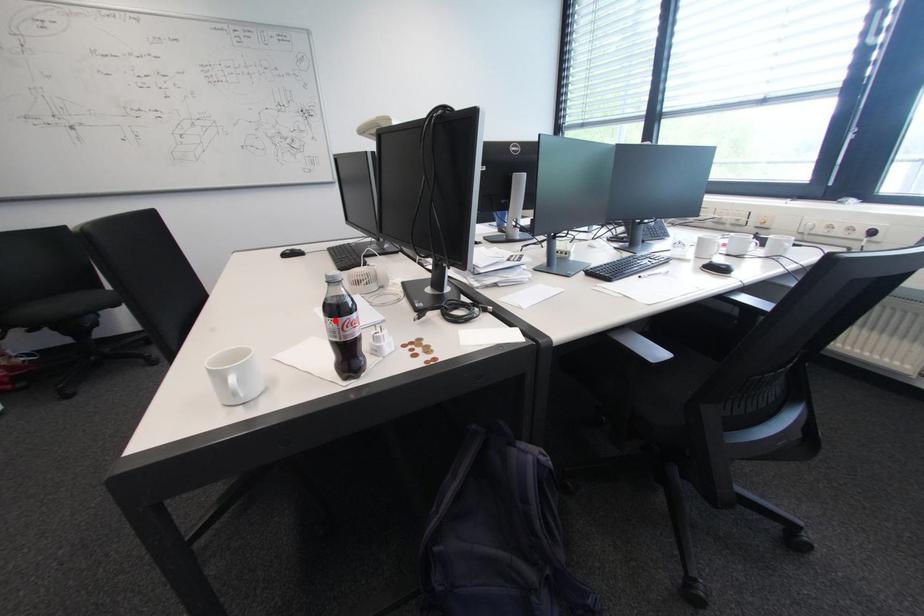
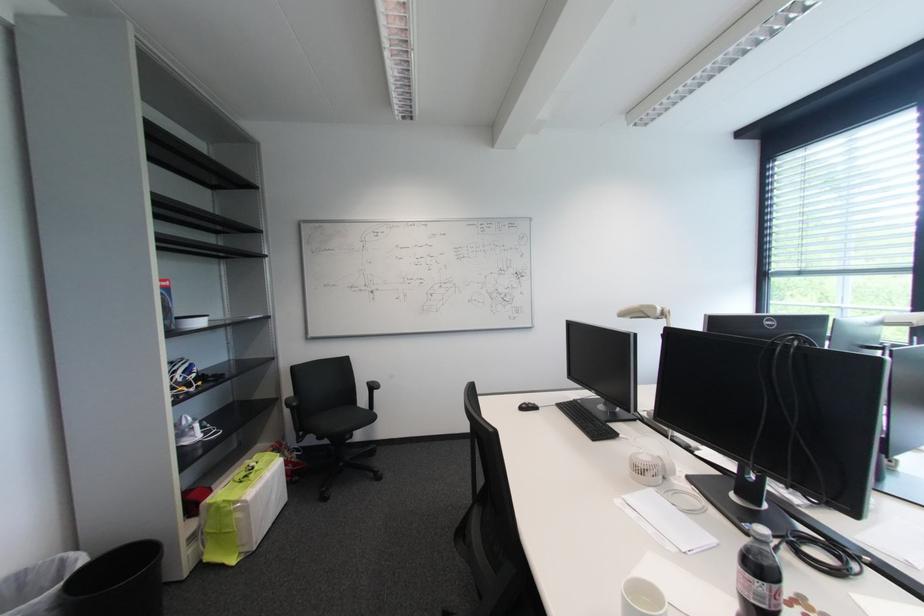
The point at the highlighted location is marked in the first image. Where is the corresponding point in the second image?

(766, 583)